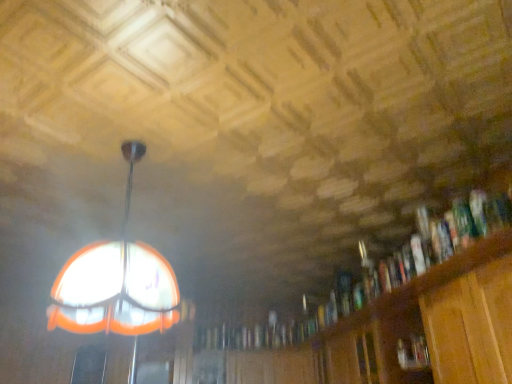
Question: From a real-world perspective, does wooden bookcase at right stand above wooden cabinet at lower right?

Choices:
 (A) yes
 (B) no

Answer: (B)

Question: From the image's perspective, would you say wooden bookcase at right is positioned over wooden cabinet at lower right?

Choices:
 (A) yes
 (B) no

Answer: (A)

Question: Is wooden bookcase at right oriented away from wooden cabinet at lower right?

Choices:
 (A) yes
 (B) no

Answer: (B)

Question: Does wooden bookcase at right touch wooden cabinet at lower right?

Choices:
 (A) yes
 (B) no

Answer: (B)

Question: Is wooden bookcase at right bigger than wooden cabinet at lower right?

Choices:
 (A) no
 (B) yes

Answer: (B)

Question: Can you confirm if wooden bookcase at right is thinner than wooden cabinet at lower right?

Choices:
 (A) yes
 (B) no

Answer: (B)

Question: Is hardcover book at right surrounding translucent glass dome at upper left?

Choices:
 (A) yes
 (B) no

Answer: (B)

Question: Does hardcover book at right come in front of translucent glass dome at upper left?

Choices:
 (A) no
 (B) yes

Answer: (A)

Question: Does hardcover book at right have a lesser height compared to translucent glass dome at upper left?

Choices:
 (A) yes
 (B) no

Answer: (A)

Question: Is hardcover book at right with translucent glass dome at upper left?

Choices:
 (A) no
 (B) yes

Answer: (A)

Question: Is hardcover book at right far from translucent glass dome at upper left?

Choices:
 (A) yes
 (B) no

Answer: (A)

Question: Is hardcover book at right outside translucent glass dome at upper left?

Choices:
 (A) yes
 (B) no

Answer: (A)

Question: Does wooden cabinet at lower right come behind hardcover book at right?

Choices:
 (A) no
 (B) yes

Answer: (B)